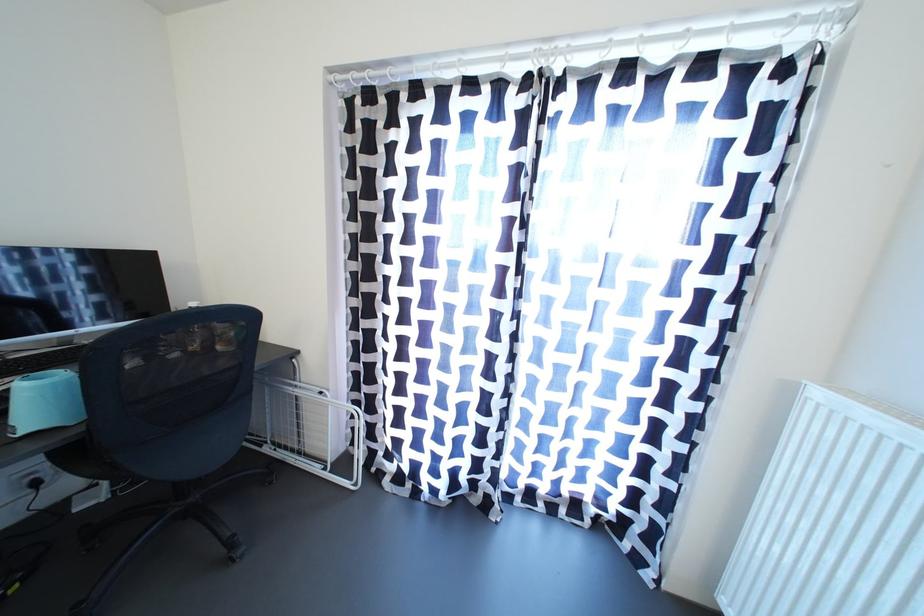
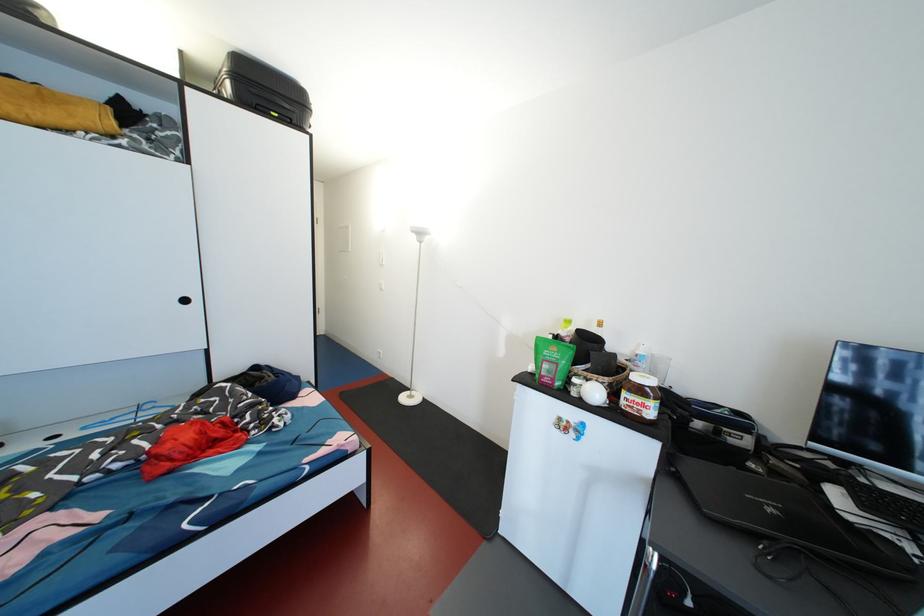
Question: The camera is either moving clockwise (left) or counter-clockwise (right) around the object. The first image is from the beginning of the video and the second image is from the end. Is the camera moving left or right when shooting the video?

Choices:
 (A) Left
 (B) Right

Answer: (B)